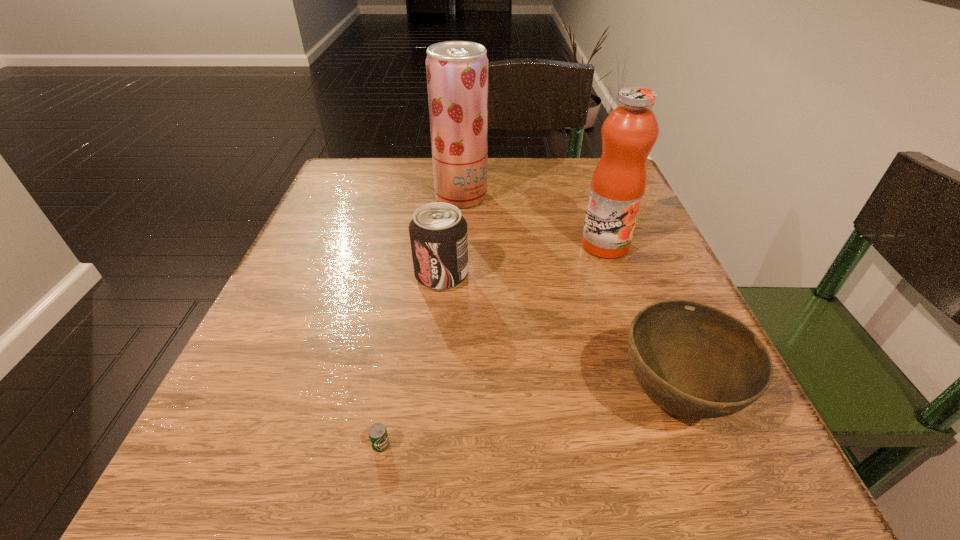
At what (x,y) coordinates should I click in order to perform the action: click on the farther fruit juice. Please return your answer as a coordinate pair (x, y). This screenshot has height=540, width=960. Looking at the image, I should click on (457, 71).

Identify the location of the left fruit juice. (457, 71).

Find the location of a particular element. the nearer fruit juice is located at coordinates (629, 132).

The image size is (960, 540). What are the coordinates of `soda can` in the screenshot? It's located at (438, 233).

Identify the location of bowl. The width and height of the screenshot is (960, 540). (695, 361).

This screenshot has width=960, height=540. I want to click on beer can, so click(x=378, y=435).

Locate an element on the screen. The height and width of the screenshot is (540, 960). blank space located 0.190m on the left of the farther fruit juice is located at coordinates (347, 197).

The height and width of the screenshot is (540, 960). Find the location of `vacant area situated 0.210m on the front label of the nearer fruit juice`. vacant area situated 0.210m on the front label of the nearer fruit juice is located at coordinates (642, 352).

You are a GUI agent. You are given a task and a screenshot of the screen. Output one action in this format:
    pyautogui.click(x=<x>, y=<y>)
    Task: Click on the vacant space located on the back of the soda can
    This screenshot has height=540, width=960.
    Given the screenshot: What is the action you would take?
    pyautogui.click(x=452, y=171)

Locate an element on the screen. vacant region located 0.330m on the left of the fourth tallest object is located at coordinates (360, 398).